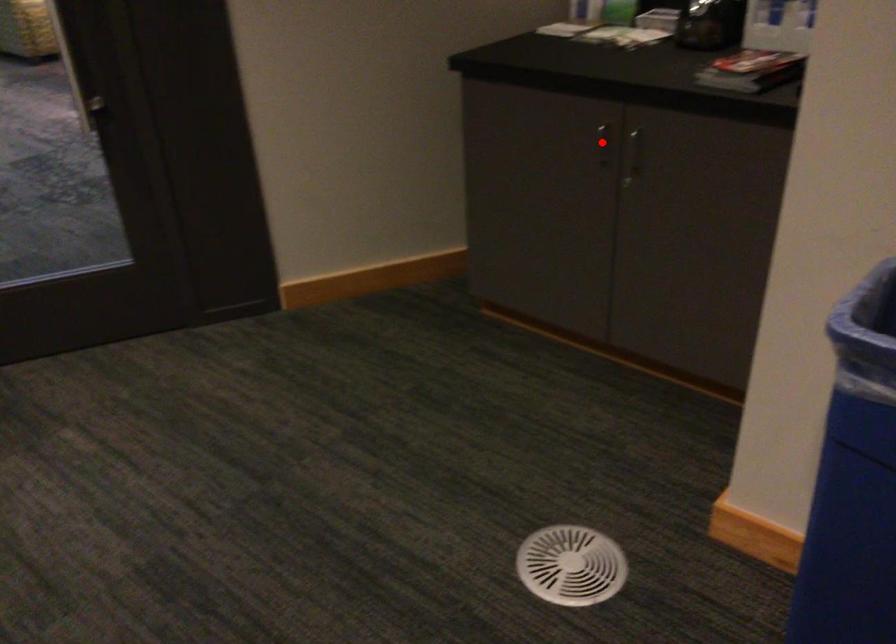
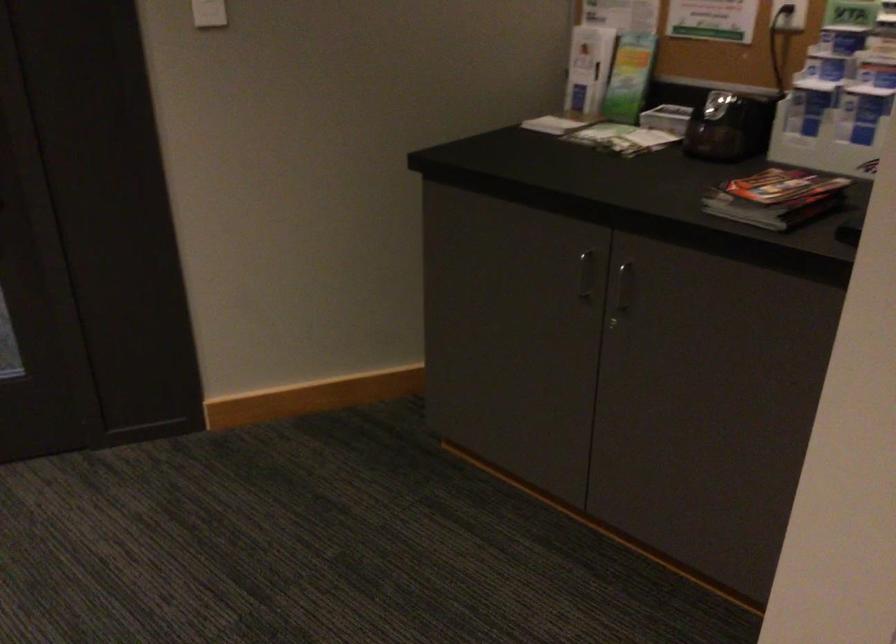
Question: I am providing you with two images of the same scene from different viewpoints. A red point is marked on the first image. Can you still see the location of the red point in image 2?

Choices:
 (A) Yes
 (B) No

Answer: (A)